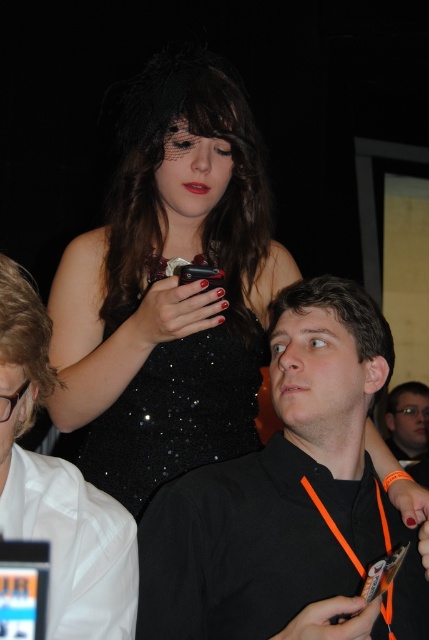
You are at a party and want to hand a drink to the person closest to you. You see the black sequined dress at upper center and the black matte shirt at center. Which one should you approach?

The black sequined dress at upper center is 32.27 centimeters away from the black matte shirt at center. Since the black sequined dress at upper center is closer to you, you should approach them first.

You are standing at the point labeled point (220, 449) in the image. You want to move to the nearest exit, which is located behind you. Can you turn around without moving your feet to face the exit?

Yes, you can turn around without moving your feet to face the exit because the point (220, 449) and viewer are 5.09 feet apart from each other, which allows enough space to turn.